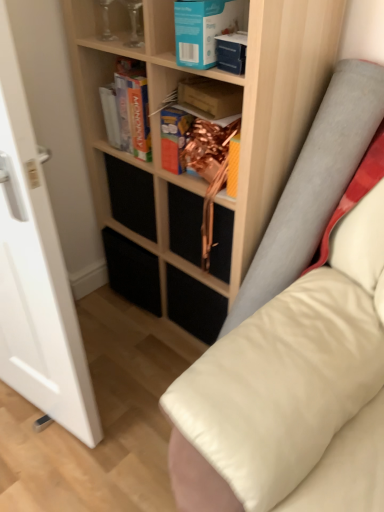
Question: Is clear glass vase at upper left, the 2th shelf from the right, in contact with blue cardboard book at upper center, the first paperback book viewed from the front?

Choices:
 (A) yes
 (B) no

Answer: (B)

Question: Can you confirm if clear glass vase at upper left, the 2th shelf from the right, is positioned to the right of blue cardboard book at upper center, the 3th paperback book positioned from the back?

Choices:
 (A) yes
 (B) no

Answer: (B)

Question: Does clear glass vase at upper left, positioned as the first shelf in left-to-right order, have a smaller size compared to blue cardboard book at upper center, the first paperback book viewed from the front?

Choices:
 (A) yes
 (B) no

Answer: (B)

Question: From a real-world perspective, is clear glass vase at upper left, positioned as the first shelf in left-to-right order, positioned over blue cardboard book at upper center, the 3th paperback book positioned from the back, based on gravity?

Choices:
 (A) yes
 (B) no

Answer: (A)

Question: Does clear glass vase at upper left, positioned as the first shelf in left-to-right order, have a greater width compared to blue cardboard book at upper center, the 3th paperback book positioned from the back?

Choices:
 (A) yes
 (B) no

Answer: (B)

Question: Is wooden shelf at center, the 2th shelf from the left, inside or outside of matte cardboard box at upper center, marked as the second paperback book in a back-to-front arrangement?

Choices:
 (A) outside
 (B) inside

Answer: (A)

Question: Is wooden shelf at center, the first shelf in the right-to-left sequence, bigger or smaller than matte cardboard box at upper center, the second paperback book when ordered from front to back?

Choices:
 (A) small
 (B) big

Answer: (B)

Question: From a real-world perspective, relative to matte cardboard box at upper center, marked as the second paperback book in a back-to-front arrangement, is wooden shelf at center, the 2th shelf from the left, vertically above or below?

Choices:
 (A) above
 (B) below

Answer: (B)

Question: In the image, is wooden shelf at center, the first shelf in the right-to-left sequence, on the left side or the right side of matte cardboard box at upper center, the second paperback book when ordered from front to back?

Choices:
 (A) left
 (B) right

Answer: (A)

Question: Would you say matte cardboard book at center, which is the 1th paperback book from back to front, is inside or outside wooden shelf at center, the first shelf in the right-to-left sequence?

Choices:
 (A) inside
 (B) outside

Answer: (A)

Question: Does point (170, 165) appear closer or farther from the camera than point (157, 20)?

Choices:
 (A) closer
 (B) farther

Answer: (B)

Question: In terms of height, does matte cardboard book at center, which ranks as the third paperback book in front-to-back order, look taller or shorter compared to wooden shelf at center, the 2th shelf from the left?

Choices:
 (A) short
 (B) tall

Answer: (A)

Question: From a real-world perspective, is matte cardboard book at center, which ranks as the third paperback book in front-to-back order, positioned above or below wooden shelf at center, the 2th shelf from the left?

Choices:
 (A) above
 (B) below

Answer: (A)

Question: Considering the positions of transparent glass door at left and clear glass vase at upper left, positioned as the first shelf in left-to-right order, in the image, is transparent glass door at left taller or shorter than clear glass vase at upper left, positioned as the first shelf in left-to-right order,?

Choices:
 (A) tall
 (B) short

Answer: (A)

Question: Is point (0, 375) positioned closer to the camera than point (94, 4)?

Choices:
 (A) closer
 (B) farther

Answer: (B)